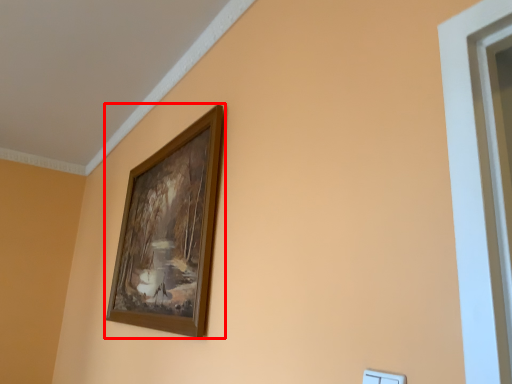
Question: From the image's perspective, where is picture frame (annotated by the red box) located in relation to light switch in the image?

Choices:
 (A) below
 (B) above

Answer: (B)